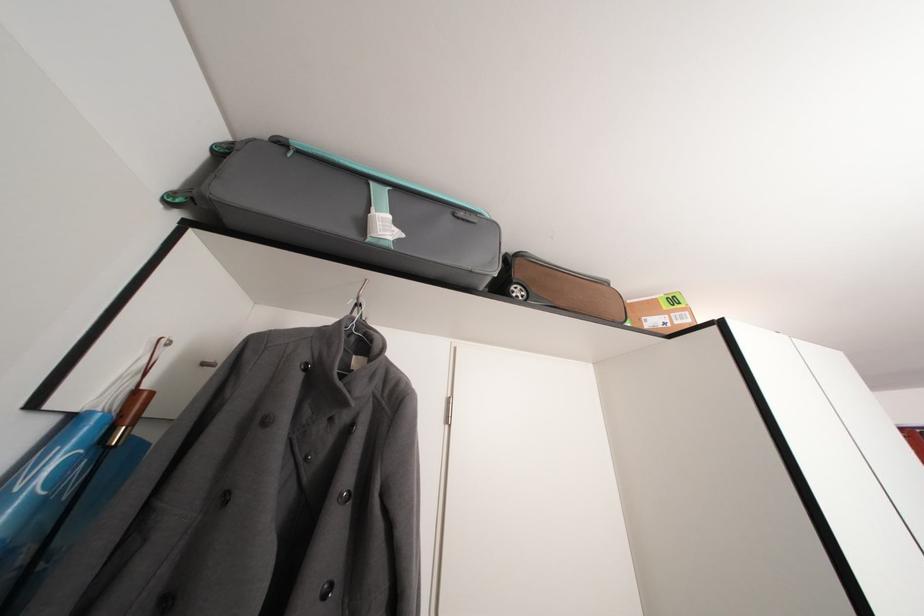
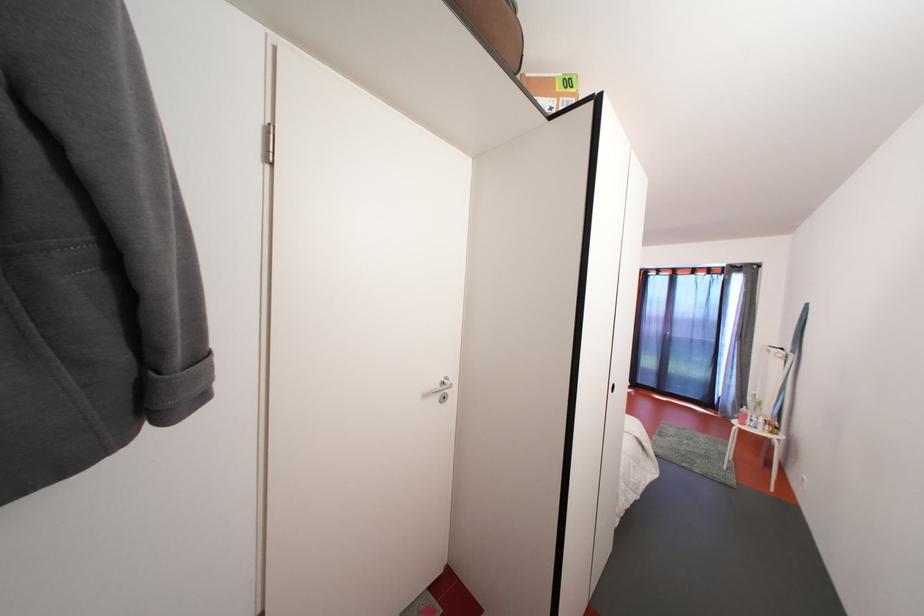
Based on the continuous images, in which direction is the camera rotating?

The camera rotated toward right-down.